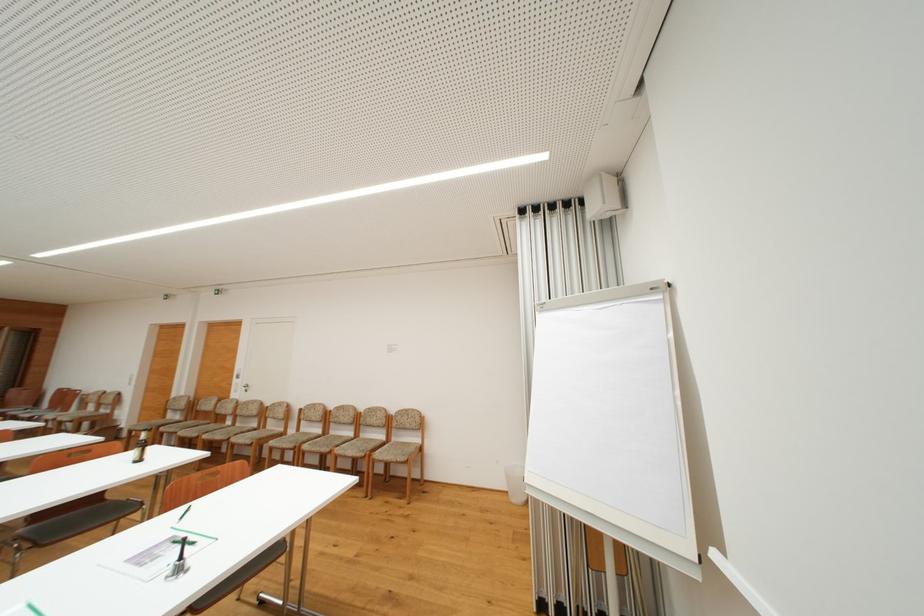
At what (x,y) coordinates should I click in order to perform the action: click on white paper booklet. Please return your answer as a coordinate pair (x, y). Looking at the image, I should click on (613, 419).